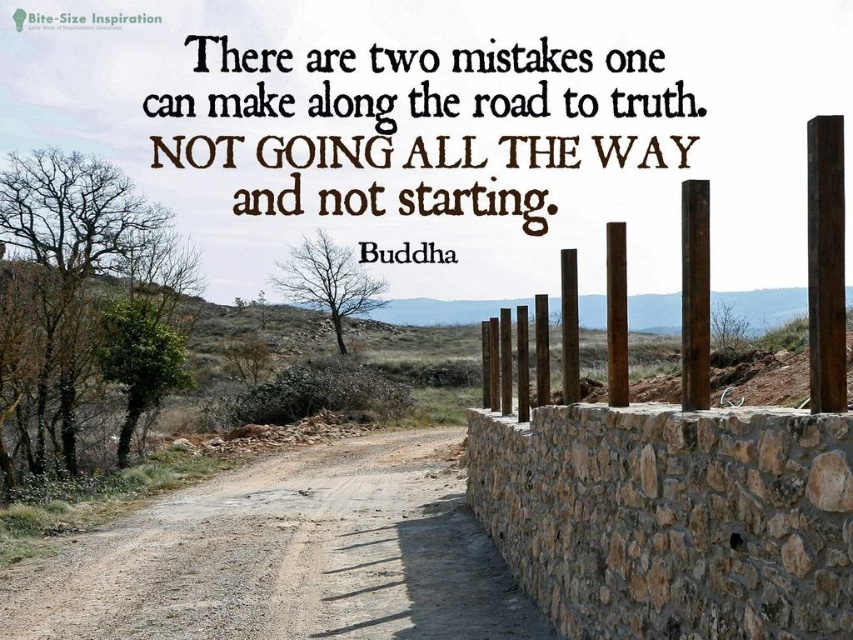
Which is in front, point (173, 621) or point (824, 250)?

Point (824, 250) is more forward.

Who is lower down, brown gravel road at center or rustic wood posts at right?

brown gravel road at center is lower down.

Is point (537, 611) positioned before point (694, 362)?

No.

Locate an element on the screen. brown gravel road at center is located at coordinates (288, 557).